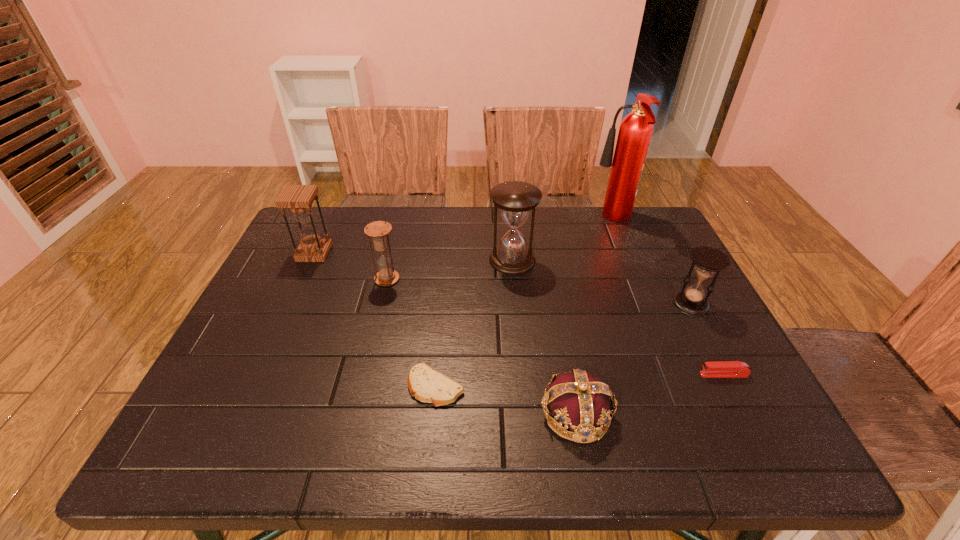
Select which hourglass appears as the second closest to the third hourglass from left to right. Please provide its 2D coordinates. Your answer should be formatted as a tuple, i.e. [(x, y)], where the tuple contains the x and y coordinates of a point satisfying the conditions above.

[(707, 260)]

Find the location of a particular element. free space that satisfies the following two spatial constraints: 1. on the front side of the fifth farthest object; 2. on the right side of the leftmost object is located at coordinates (291, 304).

What are the coordinates of `free space that satisfies the following two spatial constraints: 1. at the nozzle of the fire extinguisher; 2. on the front side of the second object from left to right` in the screenshot? It's located at (637, 279).

Locate an element on the screen. Image resolution: width=960 pixels, height=540 pixels. free space that satisfies the following two spatial constraints: 1. on the front side of the second hourglass from right to left; 2. on the right side of the rightmost hourglass is located at coordinates (516, 304).

The height and width of the screenshot is (540, 960). What are the coordinates of `free space that satisfies the following two spatial constraints: 1. at the nozzle of the fire extinguisher; 2. on the left side of the nearest hourglass` in the screenshot? It's located at (647, 304).